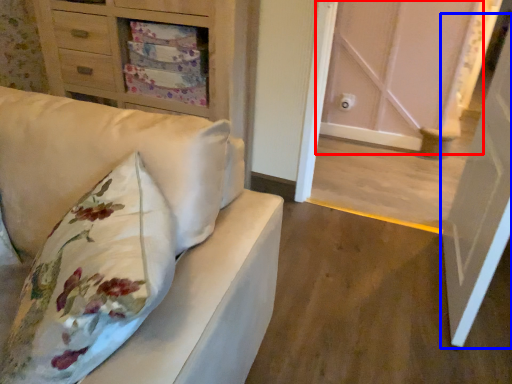
Question: Among these objects, which one is nearest to the camera, door (highlighted by a red box) or door (highlighted by a blue box)?

Choices:
 (A) door
 (B) door

Answer: (B)